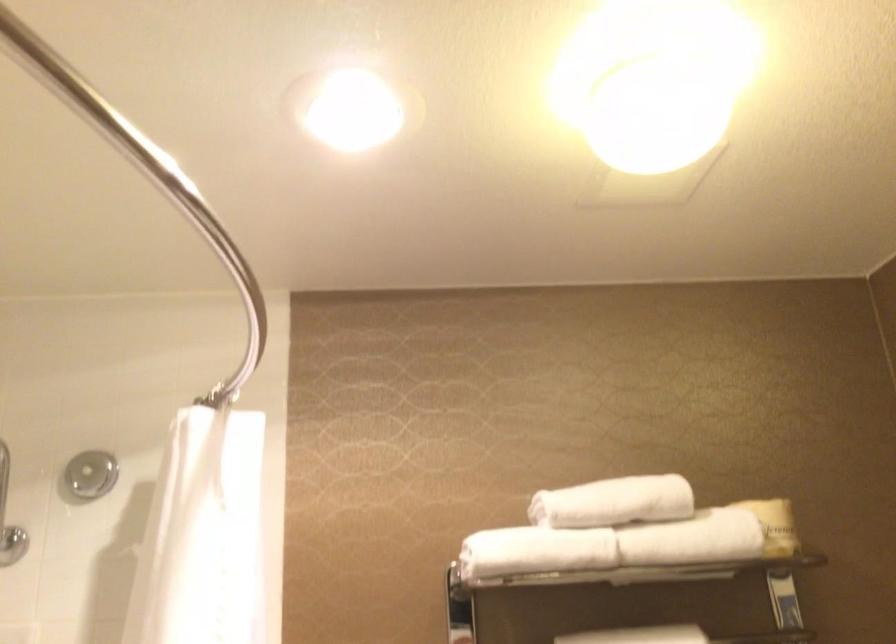
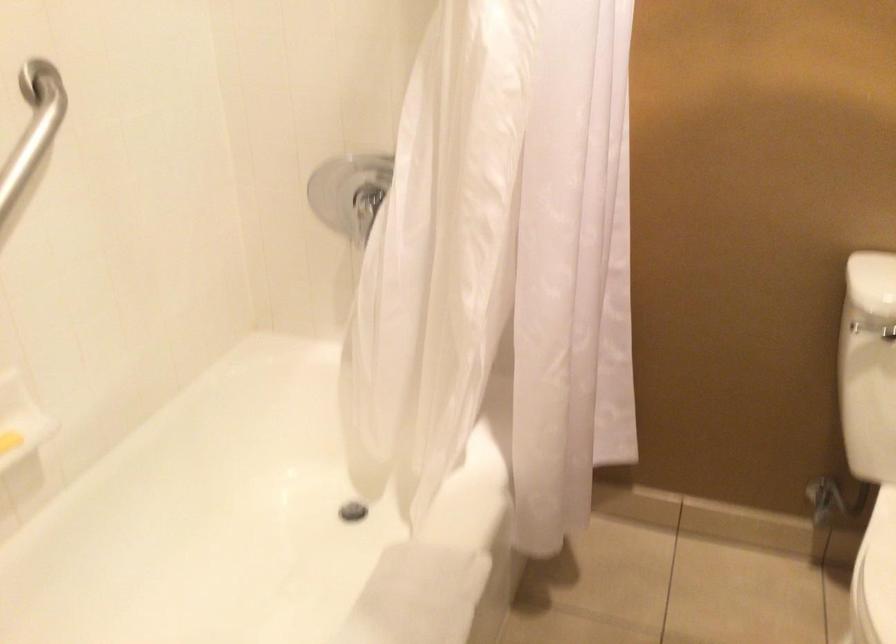
The first image is from the beginning of the video and the second image is from the end. How did the camera likely rotate when shooting the video?

The rotation direction of the camera is left-down.